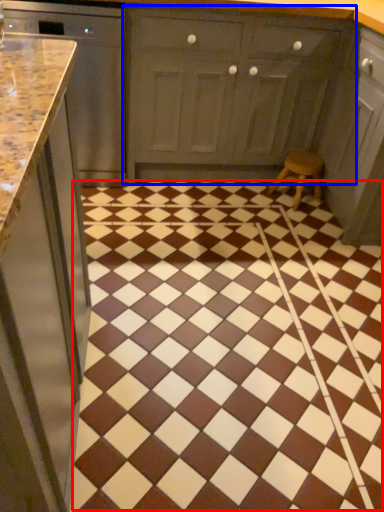
Question: Among these objects, which one is nearest to the camera, ceramic tile (highlighted by a red box) or cabinetry (highlighted by a blue box)?

Choices:
 (A) ceramic tile
 (B) cabinetry

Answer: (A)